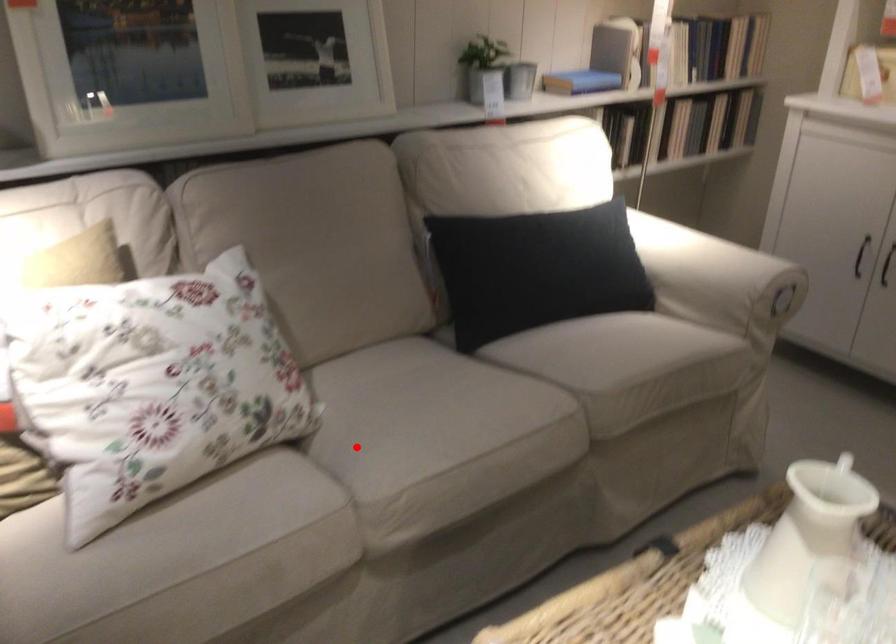
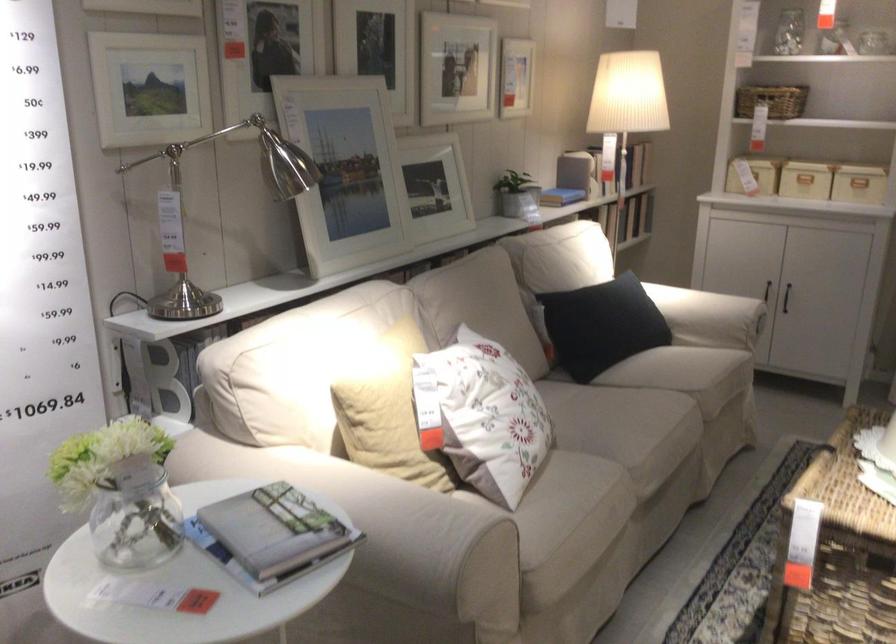
Question: A red point is marked in image1. In image2, is the corresponding 3D point closer to the camera or farther? Reply with the corresponding letter.

Choices:
 (A) The corresponding 3D point is closer.
 (B) The corresponding 3D point is farther.

Answer: (B)